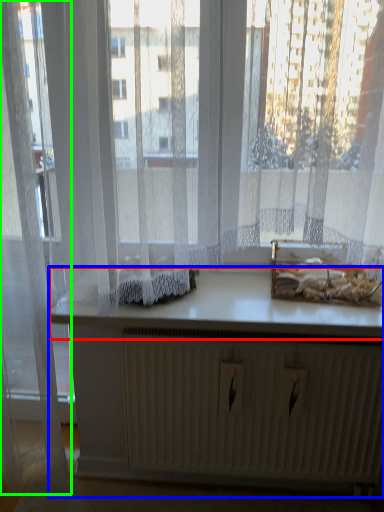
Question: Based on their relative distances, which object is nearer to counter top (highlighted by a red box)? Choose from vanity (highlighted by a blue box) and curtain (highlighted by a green box).

Choices:
 (A) vanity
 (B) curtain

Answer: (A)